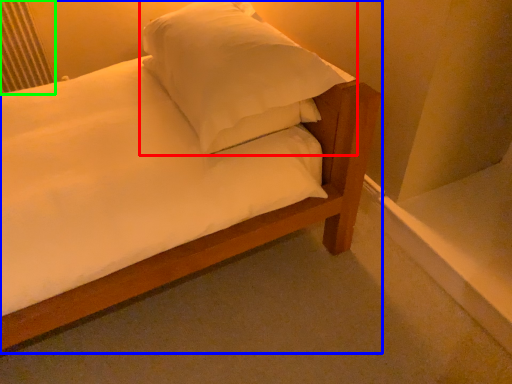
Question: Considering the real-world distances, which object is closest to pillow (highlighted by a red box)? bed (highlighted by a blue box) or radiator (highlighted by a green box).

Choices:
 (A) bed
 (B) radiator

Answer: (A)